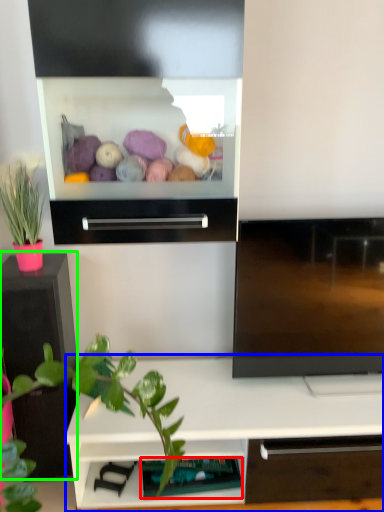
Question: Estimate the real-world distances between objects in this image. Which object is closer to shelf (highlighted by a red box), shelf (highlighted by a blue box) or tv cabinet (highlighted by a green box)?

Choices:
 (A) shelf
 (B) tv cabinet

Answer: (A)